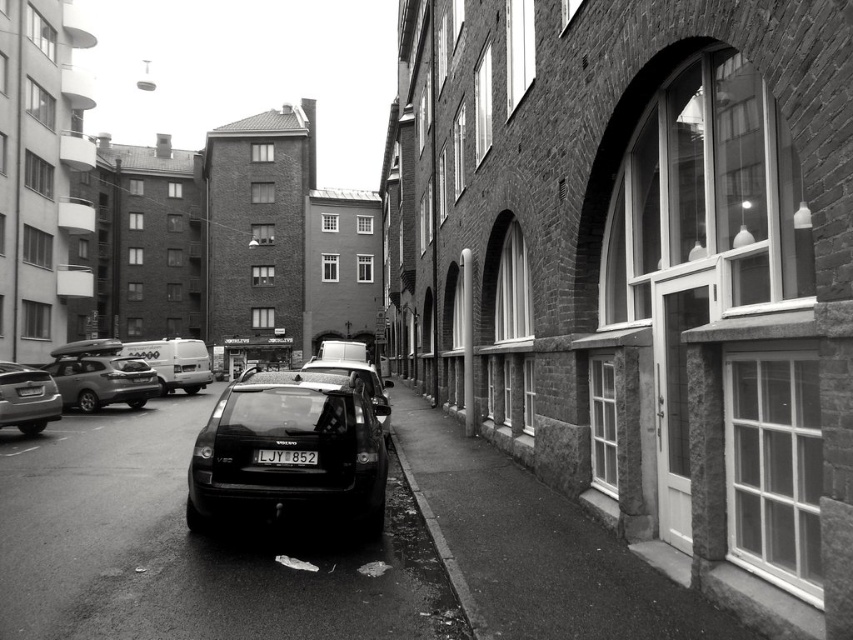
Between point (57, 404) and point (463, 618), which one is positioned behind?

Point (57, 404)

Identify the location of shiny black sedan at left. The height and width of the screenshot is (640, 853). (27, 397).

At what (x,y) coordinates should I click in order to perform the action: click on shiny black sedan at left. Please return your answer as a coordinate pair (x, y). Looking at the image, I should click on (27, 397).

Does matte black suv at left have a smaller size compared to shiny black sedan at left?

No.

Is matte black suv at left to the left of shiny black sedan at left from the viewer's perspective?

Yes, matte black suv at left is to the left of shiny black sedan at left.

This screenshot has height=640, width=853. I want to click on matte black suv at left, so click(100, 376).

Measure the distance between point (85,390) and camera.

They are 19.84 meters apart.

This screenshot has width=853, height=640. What do you see at coordinates (100, 376) in the screenshot?
I see `matte black suv at left` at bounding box center [100, 376].

Find the location of a particular element. Image resolution: width=853 pixels, height=640 pixels. matte black suv at left is located at coordinates (100, 376).